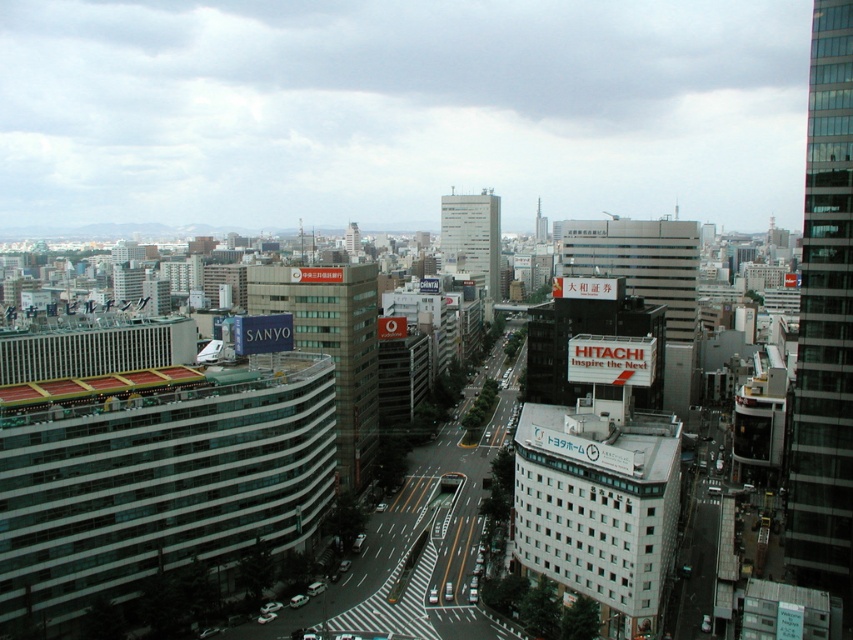
You are an urban planner reviewing this city layout. You notice the transparent glass skyscraper at right and the white glass building at center. Which of these two buildings takes up more area in the image?

The white glass building at center occupies more space than the transparent glass skyscraper at right.

You are standing at the base of the transparent glass skyscraper at right. A drone is flying towards you from the direction of the skyscraper. If the drone maintains a straight path, will it collide with the skyscraper?

The transparent glass skyscraper at right is 353.34 feet away from the viewer. Since the drone is flying towards you from the direction of the skyscraper, it is moving away from the skyscraper and therefore will not collide with it.